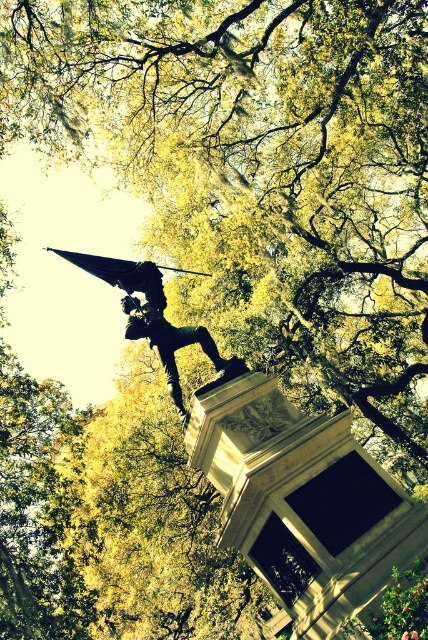
Question: Which point is farther to the camera?

Choices:
 (A) shiny bronze statue at center
 (B) bronze statue at center

Answer: (A)

Question: Is shiny bronze statue at center above bronze statue at center?

Choices:
 (A) no
 (B) yes

Answer: (A)

Question: Which point is closer to the camera taking this photo?

Choices:
 (A) (169, 346)
 (B) (145, 326)

Answer: (A)

Question: Which point is farther to the camera?

Choices:
 (A) bronze statue at center
 (B) shiny bronze statue at center

Answer: (B)

Question: Is shiny bronze statue at center positioned in front of bronze statue at center?

Choices:
 (A) yes
 (B) no

Answer: (B)

Question: Is shiny bronze statue at center to the left of bronze statue at center from the viewer's perspective?

Choices:
 (A) no
 (B) yes

Answer: (A)